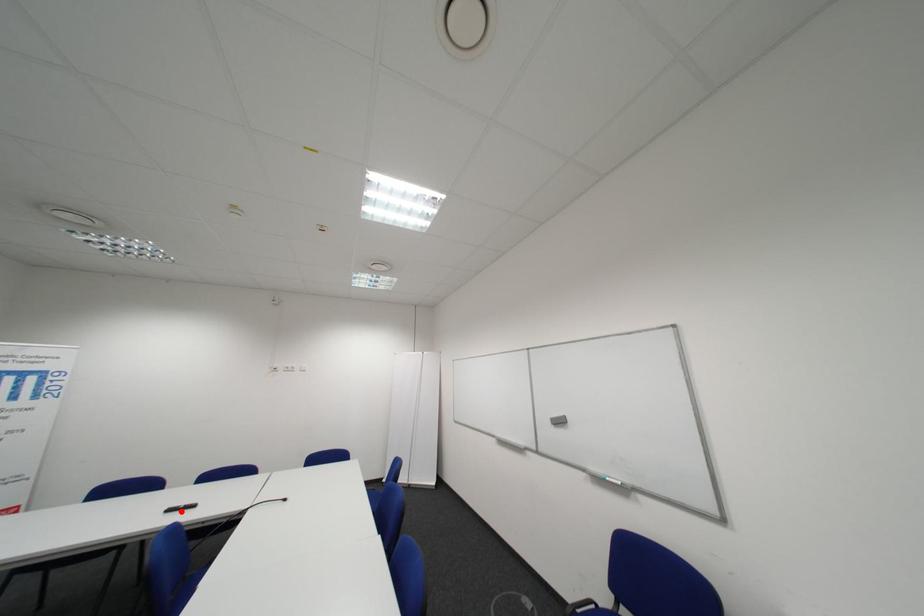
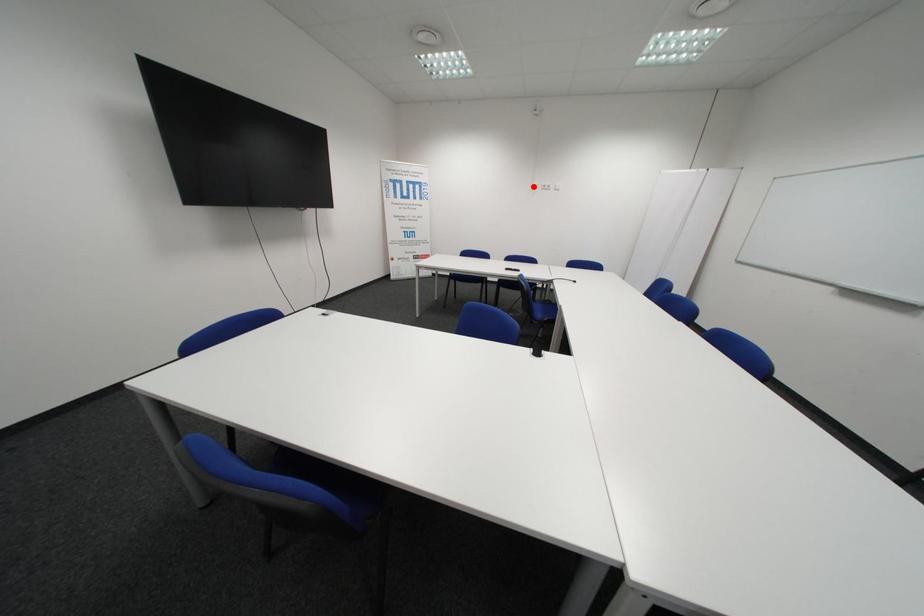
Consider the image. I am providing you with two images of the same scene from different viewpoints. A red point is marked on the first image and another point is marked on the second image. Are the points marked in image1 and image2 representing the same 3D position?

No